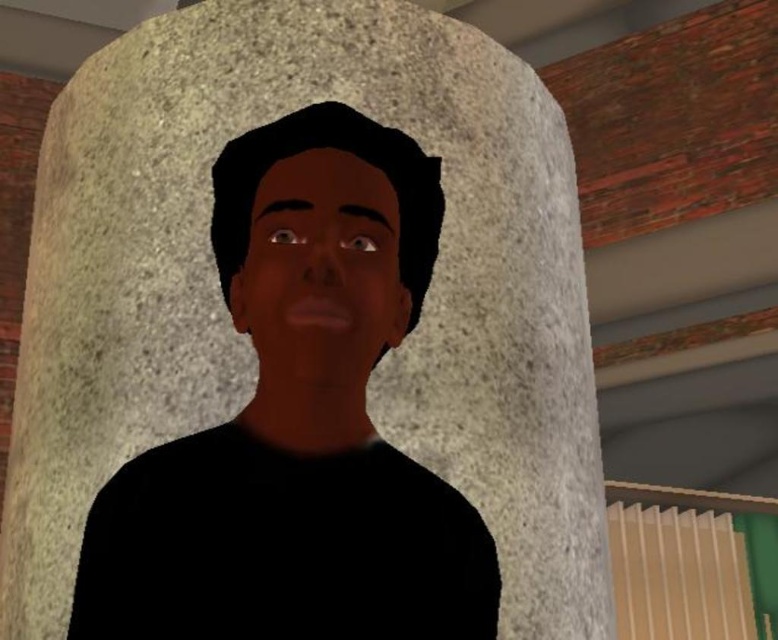
Question: Can you confirm if smooth skin face at center is wider than beige plastic radiator at lower right?

Choices:
 (A) no
 (B) yes

Answer: (A)

Question: Which point appears closest to the camera in this image?

Choices:
 (A) (312, 483)
 (B) (675, 513)
 (C) (254, 240)

Answer: (A)

Question: From the image, what is the correct spatial relationship of matte black man at center in relation to smooth skin face at center?

Choices:
 (A) below
 (B) above

Answer: (A)

Question: Which of the following is the farthest from the observer?

Choices:
 (A) (405, 205)
 (B) (659, 531)

Answer: (B)

Question: Considering the real-world distances, which object is closest to the smooth skin face at center?

Choices:
 (A) matte black man at center
 (B) beige plastic radiator at lower right

Answer: (A)

Question: Can you confirm if matte black man at center is thinner than beige plastic radiator at lower right?

Choices:
 (A) no
 (B) yes

Answer: (B)